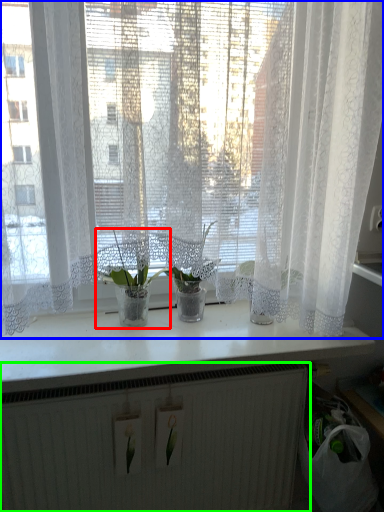
Question: Which object is the closest to the houseplant (highlighted by a red box)? Choose among these: curtain (highlighted by a blue box) or radiator (highlighted by a green box).

Choices:
 (A) curtain
 (B) radiator

Answer: (A)